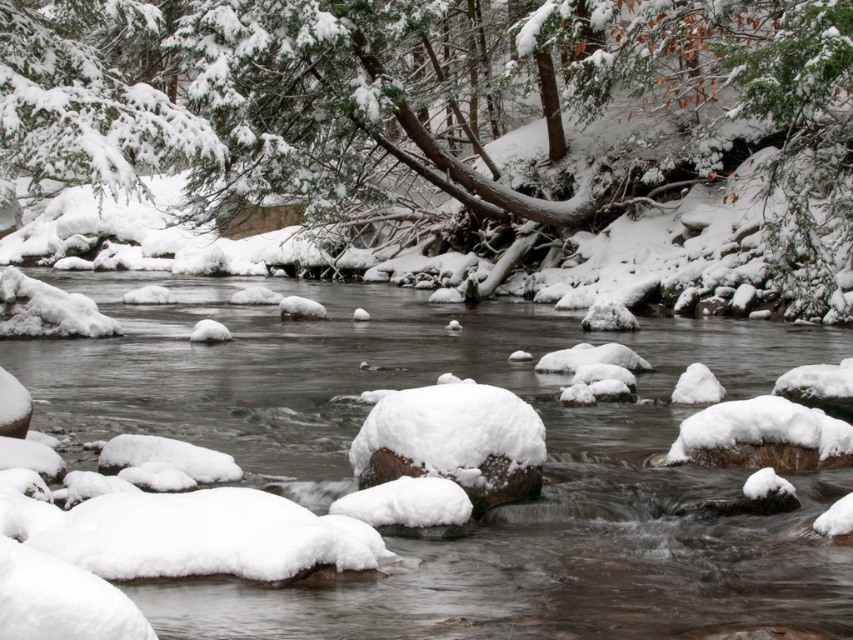
Based on the photo, who is positioned more to the right, white snow-covered rocks at center or snow-covered rock at center?

From the viewer's perspective, snow-covered rock at center appears more on the right side.

At what (x,y) coordinates should I click in order to perform the action: click on white snow-covered rocks at center. Please return your answer as a coordinate pair (x, y). Image resolution: width=853 pixels, height=640 pixels. Looking at the image, I should click on (486, 513).

The image size is (853, 640). I want to click on white snow-covered rocks at center, so click(486, 513).

Is point (630, 141) closer to camera compared to point (685, 352)?

No.

The image size is (853, 640). I want to click on green matte tree at center, so click(440, 108).

Can you confirm if green matte tree at center is taller than snow-covered rock at center?

Correct, green matte tree at center is much taller as snow-covered rock at center.

Can you confirm if green matte tree at center is thinner than snow-covered rock at center?

In fact, green matte tree at center might be wider than snow-covered rock at center.

Which is in front, point (260, 198) or point (518, 460)?

Positioned in front is point (518, 460).

Image resolution: width=853 pixels, height=640 pixels. Find the location of `green matte tree at center`. green matte tree at center is located at coordinates [440, 108].